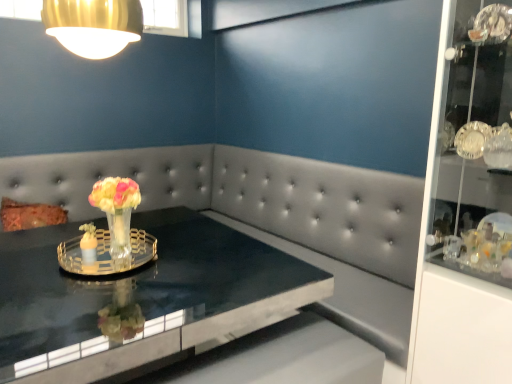
Locate an element on the screen. The height and width of the screenshot is (384, 512). vacant space to the right of clear glass tray at center is located at coordinates (199, 268).